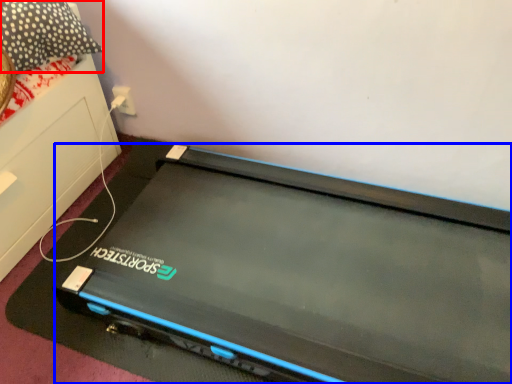
Question: Among these objects, which one is nearest to the camera, pillow (highlighted by a red box) or computer (highlighted by a blue box)?

Choices:
 (A) pillow
 (B) computer

Answer: (B)